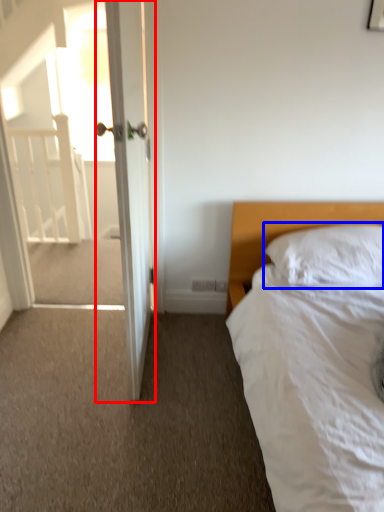
Question: Which point is further to the camera, door (highlighted by a red box) or pillow (highlighted by a blue box)?

Choices:
 (A) door
 (B) pillow

Answer: (B)